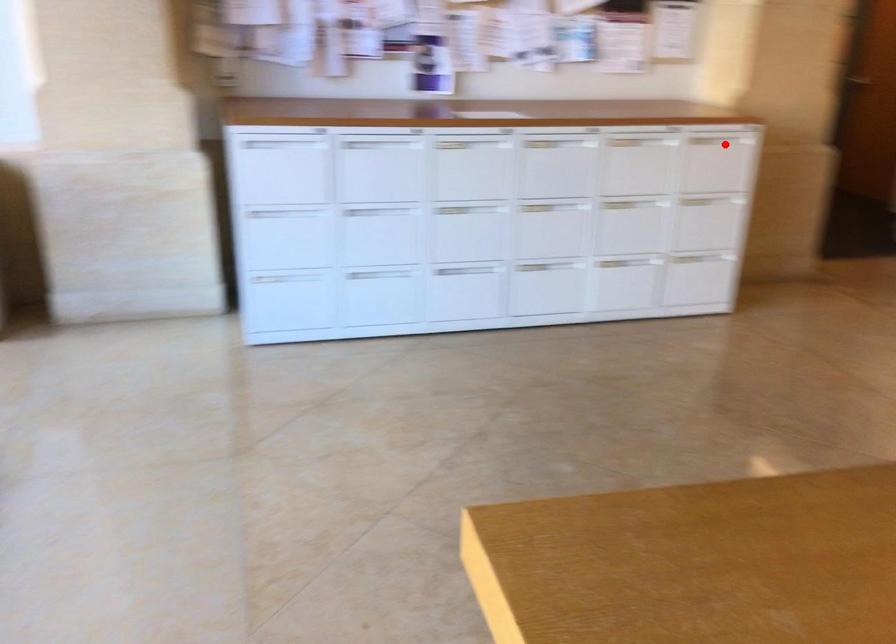
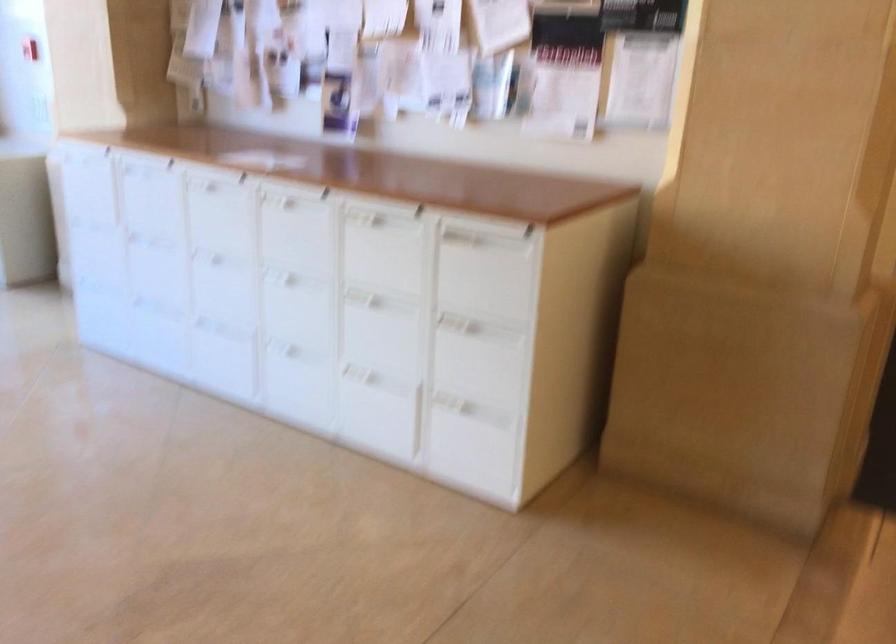
In the second image, find the point that corresponds to the highlighted location in the first image.

(487, 269)